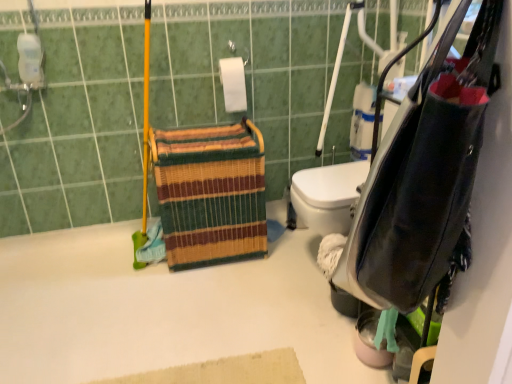
Question: Is point (414, 124) closer or farther from the camera than point (167, 144)?

Choices:
 (A) farther
 (B) closer

Answer: (B)

Question: Considering the positions of leather-like black bag at right and multicolored woven basket at center in the image, is leather-like black bag at right wider or thinner than multicolored woven basket at center?

Choices:
 (A) thin
 (B) wide

Answer: (A)

Question: Based on their relative distances, which object is nearer to the multicolored woven basket at center?

Choices:
 (A) white matte toilet paper at upper center
 (B) white matte bath at upper left
 (C) leather-like black bag at right

Answer: (B)

Question: Considering the real-world distances, which object is closest to the leather-like black bag at right?

Choices:
 (A) white matte bath at upper left
 (B) white matte toilet paper at upper center
 (C) multicolored woven basket at center

Answer: (A)